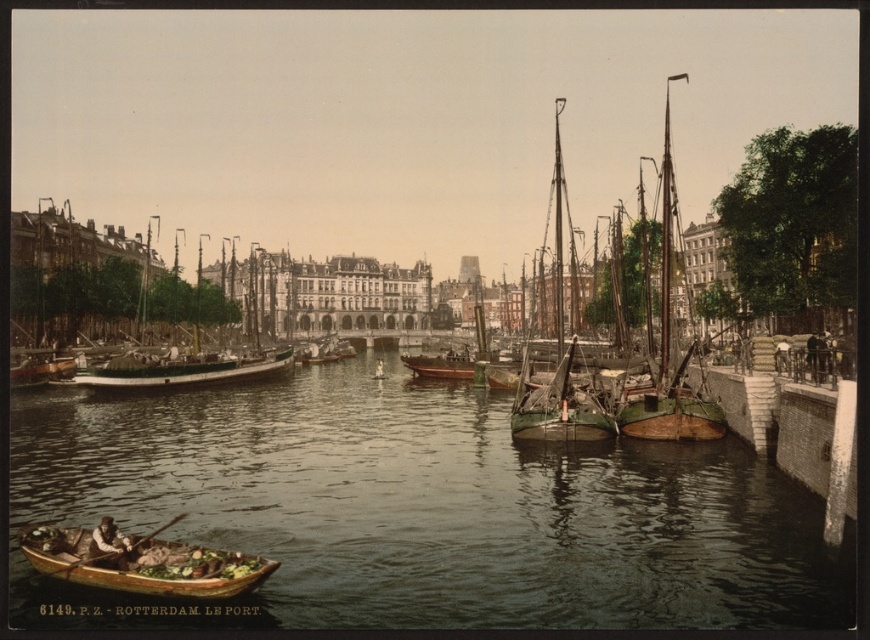
You are a tour guide leading a group along the canal in Rotterdam. You want to point out the wooden canoe at lower left and the greenish water at center to your tourists. How far apart are these two landmarks?

The greenish water at center and wooden canoe at lower left are 18.29 meters apart.

You are standing on the left bank of the canal in Rotterdam. You see the greenish water at center and the wooden sailboat at right. Which object is closer to you?

The greenish water at center is closer to you because it is in front of the wooden sailboat at right.